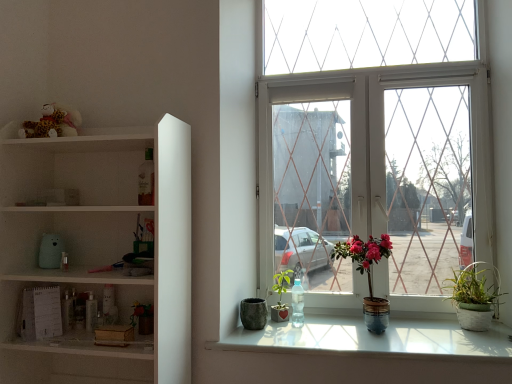
Question: Does point (296, 314) appear closer or farther from the camera than point (453, 286)?

Choices:
 (A) farther
 (B) closer

Answer: (A)

Question: From a real-world perspective, relative to white woven basket at lower right, placed as the first houseplant when sorted from right to left, is transparent plastic bottle at window vertically above or below?

Choices:
 (A) below
 (B) above

Answer: (A)

Question: Considering the real-world distances, which object is farthest from the transparent plastic bottle at window?

Choices:
 (A) clear glass window at center
 (B) matte ceramic pot at center, the 2th houseplant when ordered from right to left
 (C) green matte plant at center, arranged as the 2th houseplant when viewed from the left
 (D) white glossy window sill at lower center
 (E) white matte shelf at left

Answer: (E)

Question: Which object is the closest to the matte ceramic pot at center, the 2th houseplant when ordered from right to left?

Choices:
 (A) fluffy plush teddy bear at upper left
 (B) white matte shelf at left
 (C) transparent plastic bottle at window
 (D) green matte plant at lower left, the 1th houseplant positioned from the left
 (E) matte gray stone pot at lower center

Answer: (C)